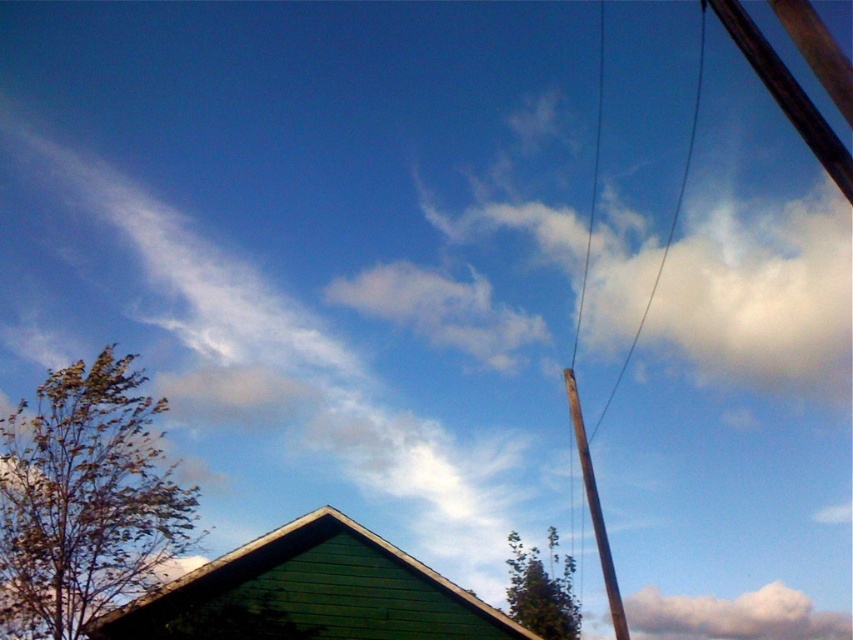
Between white fluffy cloud at upper center and brown wire at upper right, which one has more height?

With more height is brown wire at upper right.

Who is positioned more to the left, white fluffy cloud at upper center or brown wire at upper right?

brown wire at upper right is more to the left.

Where is `white fluffy cloud at upper center`? Image resolution: width=853 pixels, height=640 pixels. white fluffy cloud at upper center is located at coordinates (734, 616).

Where is `white fluffy cloud at upper center`? This screenshot has width=853, height=640. white fluffy cloud at upper center is located at coordinates (734, 616).

Can you confirm if white fluffy cloud at upper center is shorter than green leafy tree at lower center?

Yes, white fluffy cloud at upper center is shorter than green leafy tree at lower center.

Can you confirm if white fluffy cloud at upper center is smaller than green leafy tree at lower center?

Actually, white fluffy cloud at upper center might be larger than green leafy tree at lower center.

Find the location of a particular element. Image resolution: width=853 pixels, height=640 pixels. white fluffy cloud at upper center is located at coordinates (734, 616).

Locate an element on the screen. This screenshot has width=853, height=640. white fluffy cloud at upper center is located at coordinates (734, 616).

Is point (27, 621) positioned before point (682, 177)?

Yes, point (27, 621) is in front of point (682, 177).

Does brown leafy tree at lower left have a smaller size compared to brown wire at upper right?

Yes, brown leafy tree at lower left is smaller than brown wire at upper right.

Which is in front, point (94, 496) or point (704, 22)?

Positioned in front is point (94, 496).

Where is `brown leafy tree at lower left`? The width and height of the screenshot is (853, 640). brown leafy tree at lower left is located at coordinates (84, 500).